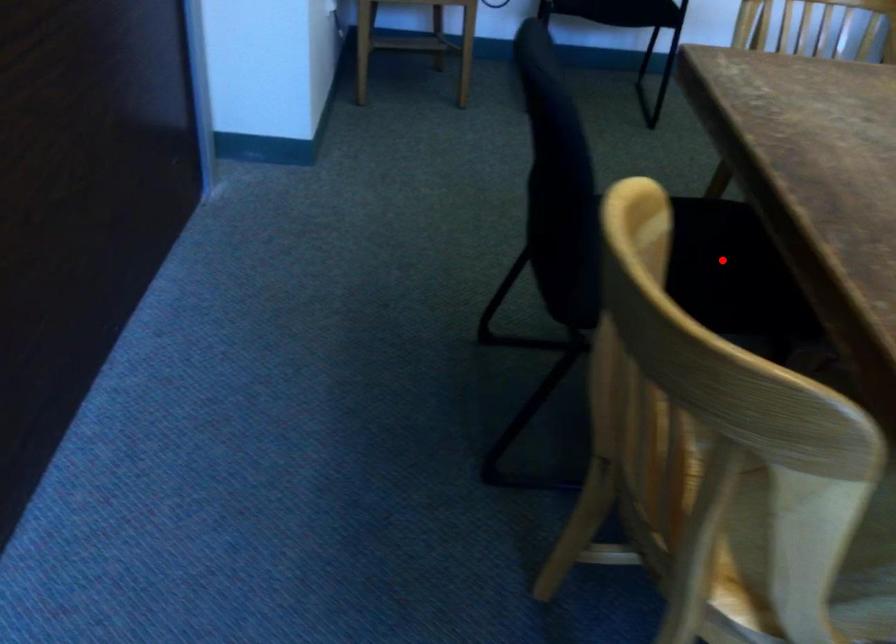
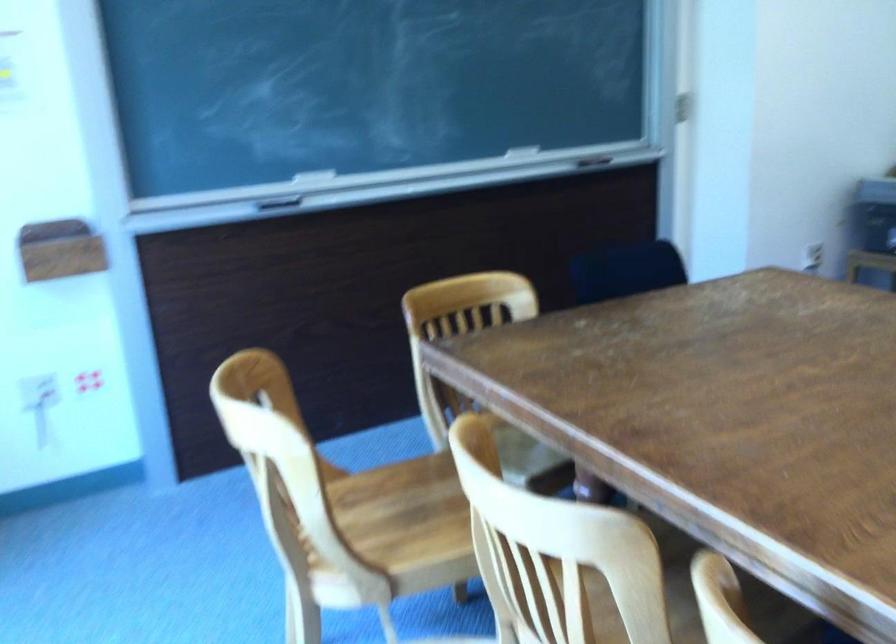
Question: I am providing you with two images of the same scene from different viewpoints. A red point is marked on the first image. At the location where the point appears in image 1, is it still visible in image 2?

Choices:
 (A) Yes
 (B) No

Answer: (B)